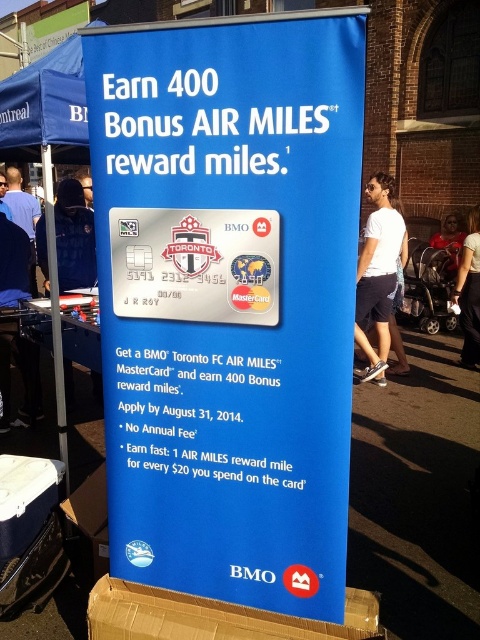
From the picture: You are a fashion designer looking at a model wearing a white cotton shirt at right and dark blue jeans at right. Which piece of clothing is more to the left?

The white cotton shirt at right is positioned on the left side of dark blue jeans at right, so the white cotton shirt at right is more to the left.

Looking at this image, you are standing in a park and see a metallic silver pole at left and a matte black shirt at center. Which object is taller?

The metallic silver pole at left is taller than the matte black shirt at center.